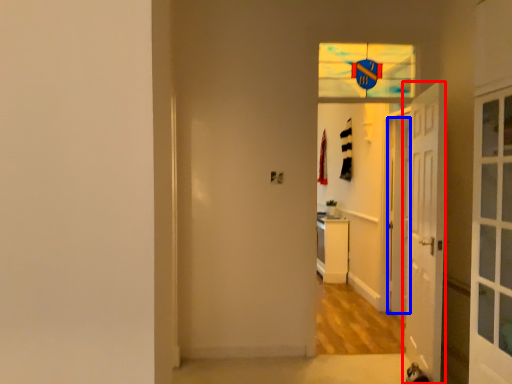
Question: Which point is further to the camera, door (highlighted by a red box) or door (highlighted by a blue box)?

Choices:
 (A) door
 (B) door

Answer: (B)